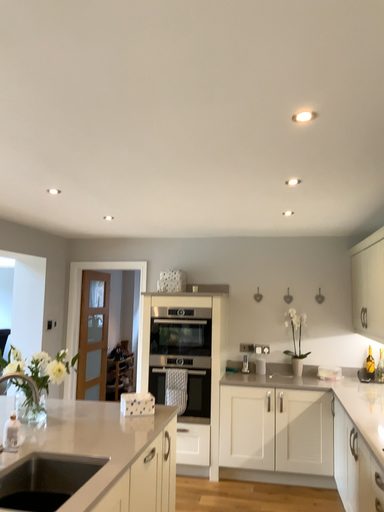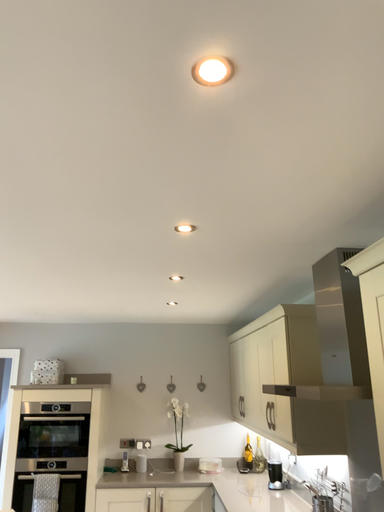
Question: How did the camera likely rotate when shooting the video?

Choices:
 (A) rotated upward
 (B) rotated downward

Answer: (A)